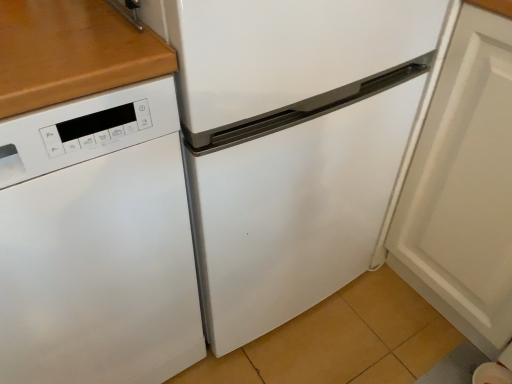
Question: Can you confirm if white matte cabinet door at lower right is bigger than white matte dishwasher at left?

Choices:
 (A) yes
 (B) no

Answer: (B)

Question: From a real-world perspective, is white matte cabinet door at lower right located beneath white matte dishwasher at left?

Choices:
 (A) yes
 (B) no

Answer: (B)

Question: Is white matte dishwasher at left at the back of white matte cabinet door at lower right?

Choices:
 (A) yes
 (B) no

Answer: (B)

Question: Does white matte cabinet door at lower right have a greater width compared to white matte dishwasher at left?

Choices:
 (A) no
 (B) yes

Answer: (A)

Question: Is white matte cabinet door at lower right not inside white matte dishwasher at left?

Choices:
 (A) yes
 (B) no

Answer: (A)

Question: Considering the relative sizes of white matte cabinet door at lower right and white matte dishwasher at left in the image provided, is white matte cabinet door at lower right thinner than white matte dishwasher at left?

Choices:
 (A) no
 (B) yes

Answer: (B)

Question: Considering the relative sizes of white matte dishwasher at left and white matte cabinet door at lower right in the image provided, is white matte dishwasher at left smaller than white matte cabinet door at lower right?

Choices:
 (A) no
 (B) yes

Answer: (A)

Question: Does white matte dishwasher at left have a greater width compared to white matte cabinet door at lower right?

Choices:
 (A) yes
 (B) no

Answer: (A)

Question: Is white matte dishwasher at left surrounding white matte cabinet door at lower right?

Choices:
 (A) yes
 (B) no

Answer: (B)

Question: Does white matte dishwasher at left turn towards white matte cabinet door at lower right?

Choices:
 (A) yes
 (B) no

Answer: (B)

Question: Considering the relative positions of white matte dishwasher at left and white matte cabinet door at lower right in the image provided, is white matte dishwasher at left in front of white matte cabinet door at lower right?

Choices:
 (A) yes
 (B) no

Answer: (A)

Question: From the image's perspective, is white matte dishwasher at left below white matte cabinet door at lower right?

Choices:
 (A) yes
 (B) no

Answer: (A)

Question: Would you say white matte cabinet door at lower right is inside or outside white matte dishwasher at left?

Choices:
 (A) outside
 (B) inside

Answer: (A)